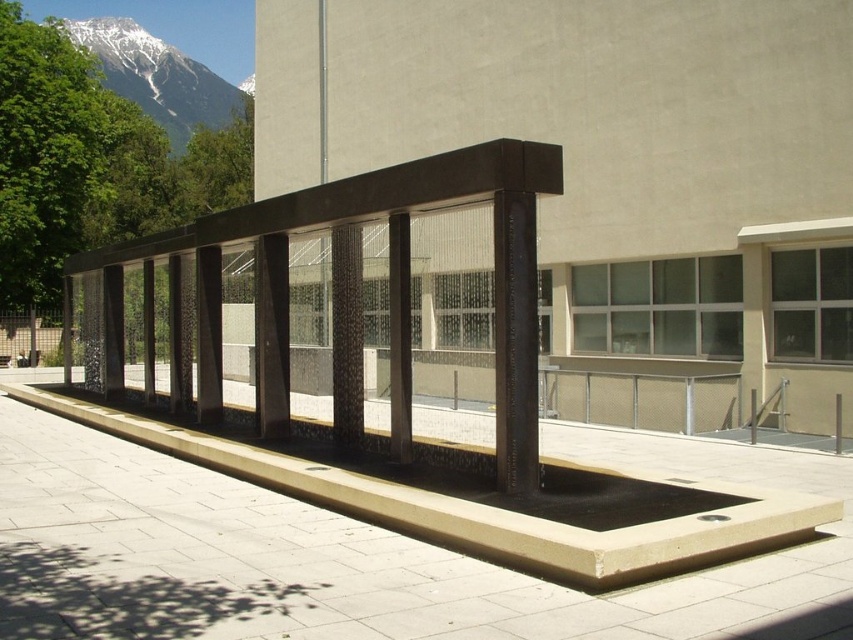
Question: Which point appears closest to the camera in this image?

Choices:
 (A) (119, 35)
 (B) (202, 362)

Answer: (B)

Question: Considering the relative positions of black textured rail at center and snowy granite mountain at upper left in the image provided, where is black textured rail at center located with respect to snowy granite mountain at upper left?

Choices:
 (A) above
 (B) below

Answer: (B)

Question: Is the position of black textured rail at center more distant than that of snowy granite mountain at upper left?

Choices:
 (A) yes
 (B) no

Answer: (B)

Question: Among these objects, which one is farthest from the camera?

Choices:
 (A) snowy granite mountain at upper left
 (B) black textured rail at center

Answer: (A)

Question: Can you confirm if black textured rail at center is positioned below snowy granite mountain at upper left?

Choices:
 (A) yes
 (B) no

Answer: (A)